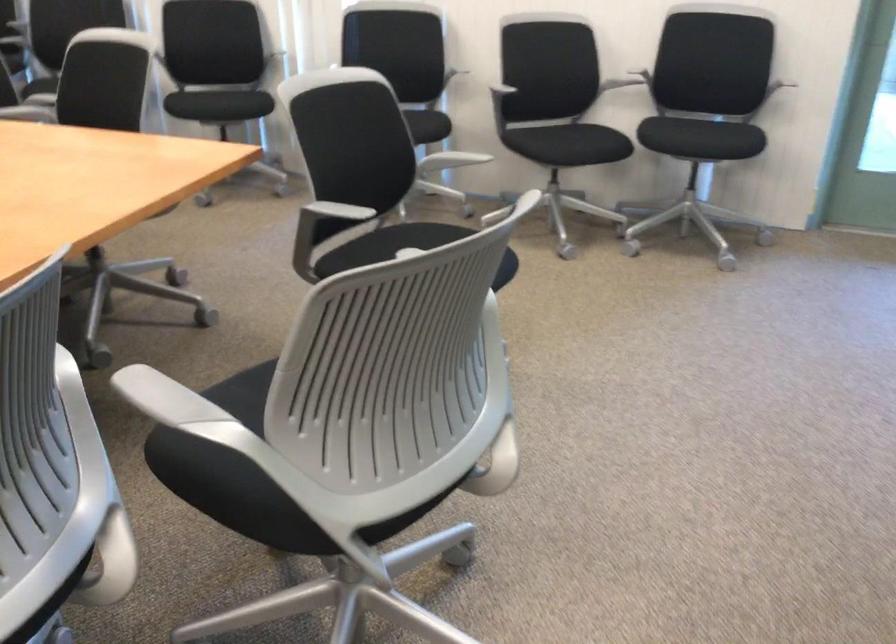
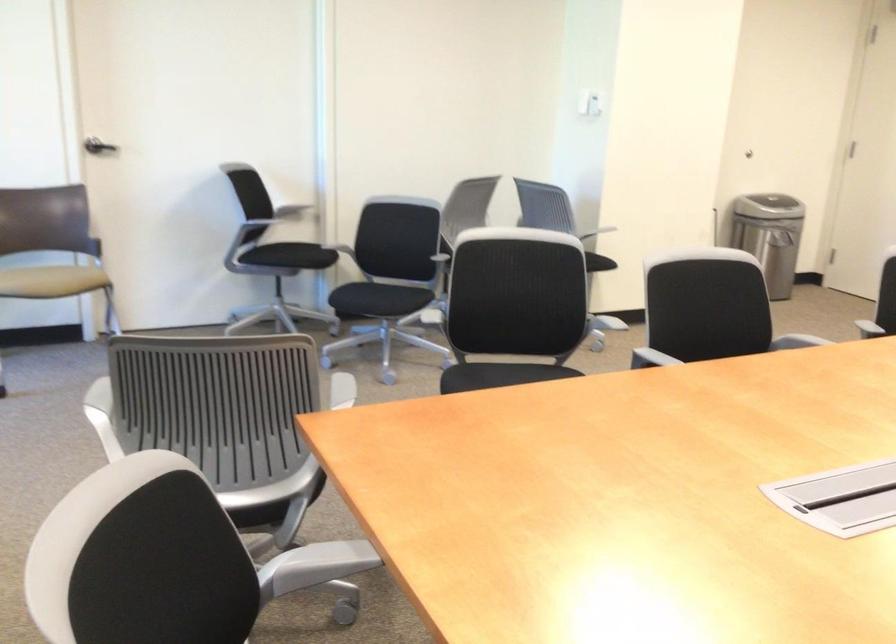
Question: I am providing you with two images of the same scene from different viewpoints. Please identify which objects are invisible in image2.

Choices:
 (A) metal trash can
 (B) mirrored sliding door
 (C) chair armrest
 (D) gray adjustment knob

Answer: (D)